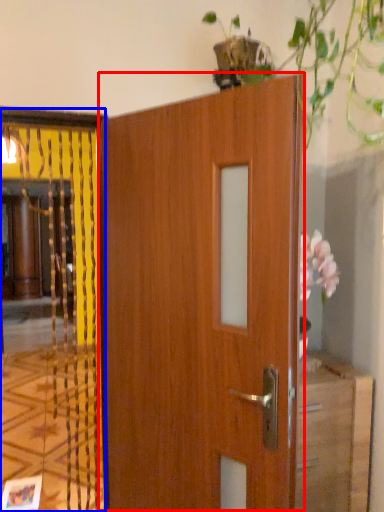
Question: Which point is closer to the camera, door (highlighted by a red box) or elevator (highlighted by a blue box)?

Choices:
 (A) door
 (B) elevator

Answer: (A)